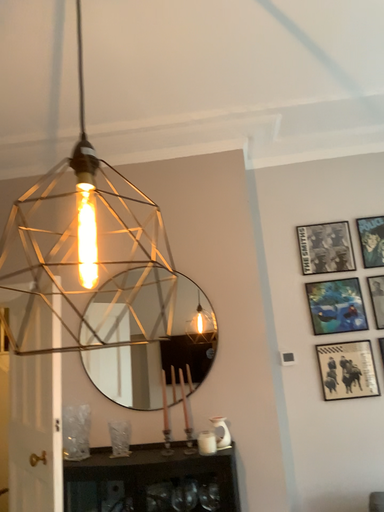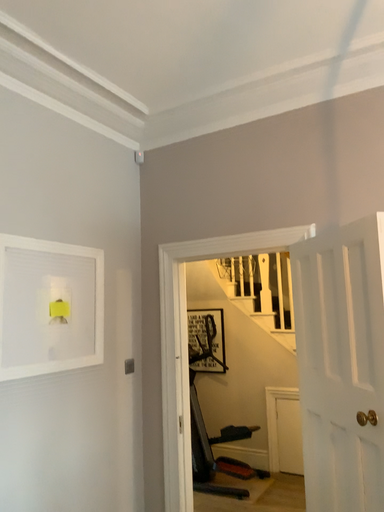
Question: Which way did the camera rotate in the video?

Choices:
 (A) rotated downward
 (B) rotated upward

Answer: (A)